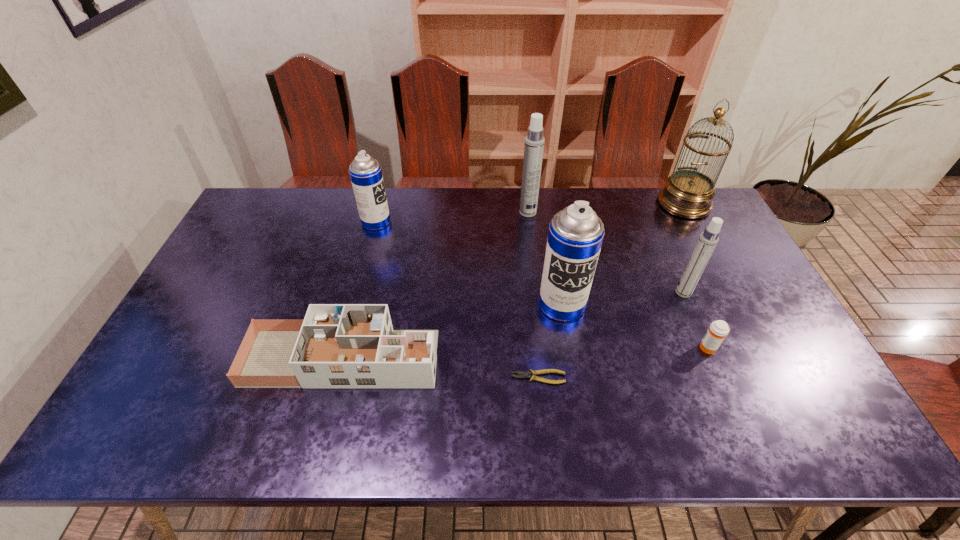
Locate an element on the screen. The height and width of the screenshot is (540, 960). the closest aerosol can to the rightmost object is located at coordinates (708, 239).

The image size is (960, 540). Identify the location of free space that satisfies the following two spatial constraints: 1. at the entrance of the dollhouse; 2. on the right side of the pliers. (337, 377).

Locate an element on the screen. free location that satisfies the following two spatial constraints: 1. with an open door on the golden birdcage; 2. at the entrance of the dollhouse is located at coordinates (766, 358).

At what (x,y) coordinates should I click in order to perform the action: click on free space that satisfies the following two spatial constraints: 1. on the front side of the bigger white aerosol can; 2. at the entrance of the dollhouse. Please return your answer as a coordinate pair (x, y). Looking at the image, I should click on (545, 358).

You are a GUI agent. You are given a task and a screenshot of the screen. Output one action in this format:
    pyautogui.click(x=<x>, y=<y>)
    Task: Click on the blank space that satisfies the following two spatial constraints: 1. on the label side of the bigger blue aerosol can; 2. on the right side of the medicine
    The height and width of the screenshot is (540, 960).
    Given the screenshot: What is the action you would take?
    pyautogui.click(x=569, y=348)